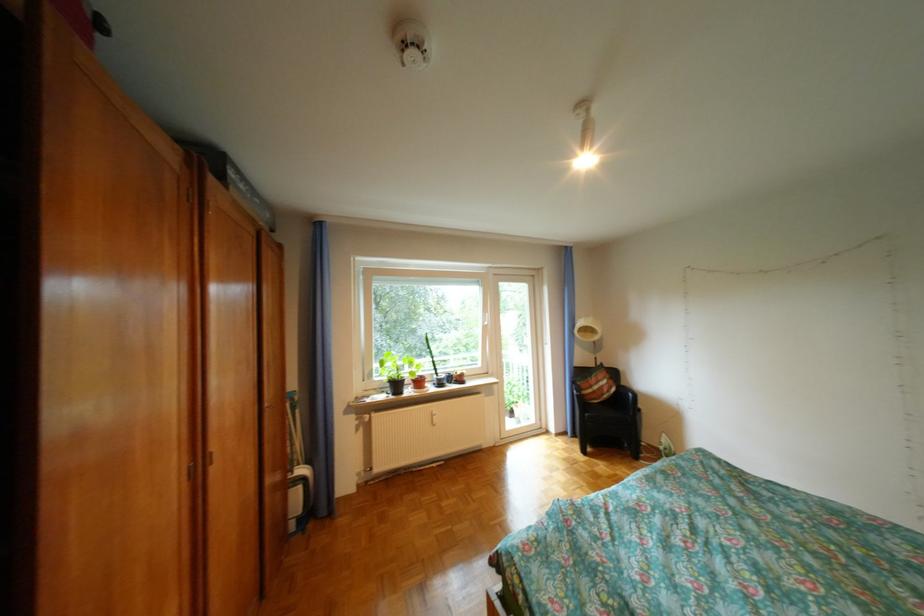
Where is `blue broom`? The height and width of the screenshot is (616, 924). blue broom is located at coordinates (321, 375).